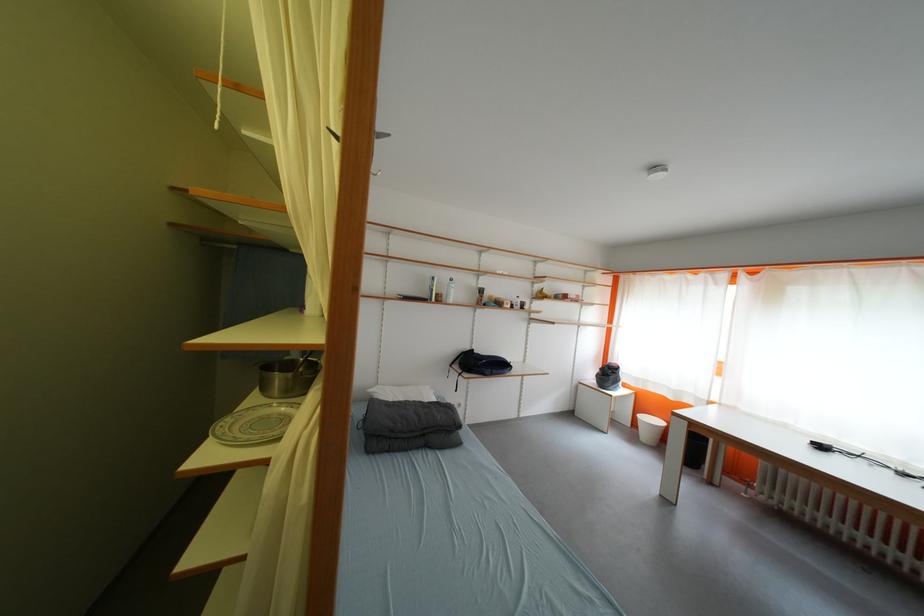
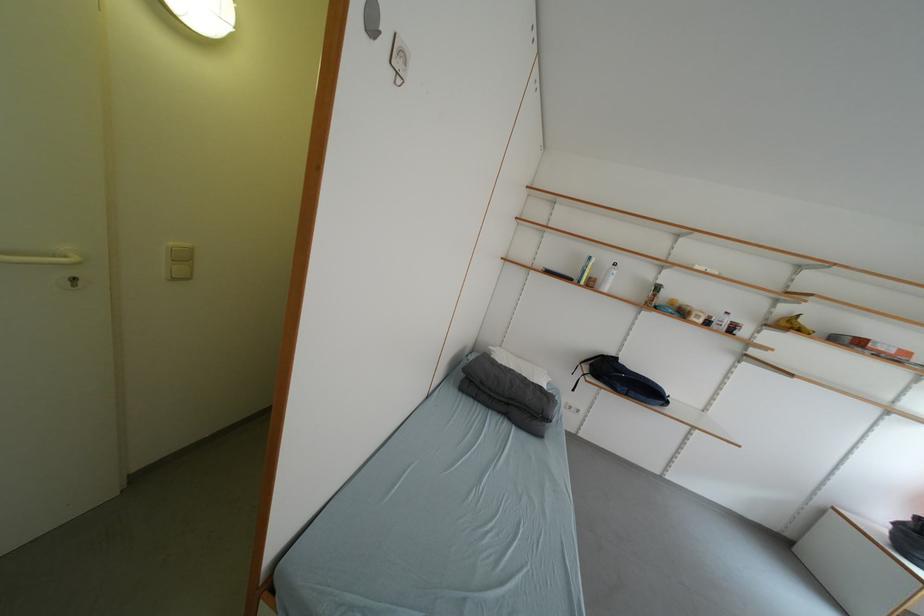
In the second image, find the point that corresponds to [586,390] in the first image.

(832, 515)